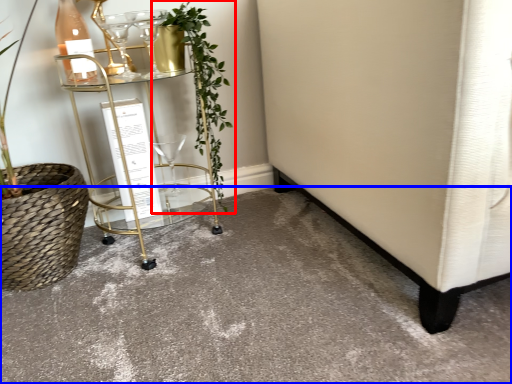
Question: Among these objects, which one is nearest to the camera, houseplant (highlighted by a red box) or concrete (highlighted by a blue box)?

Choices:
 (A) houseplant
 (B) concrete

Answer: (B)